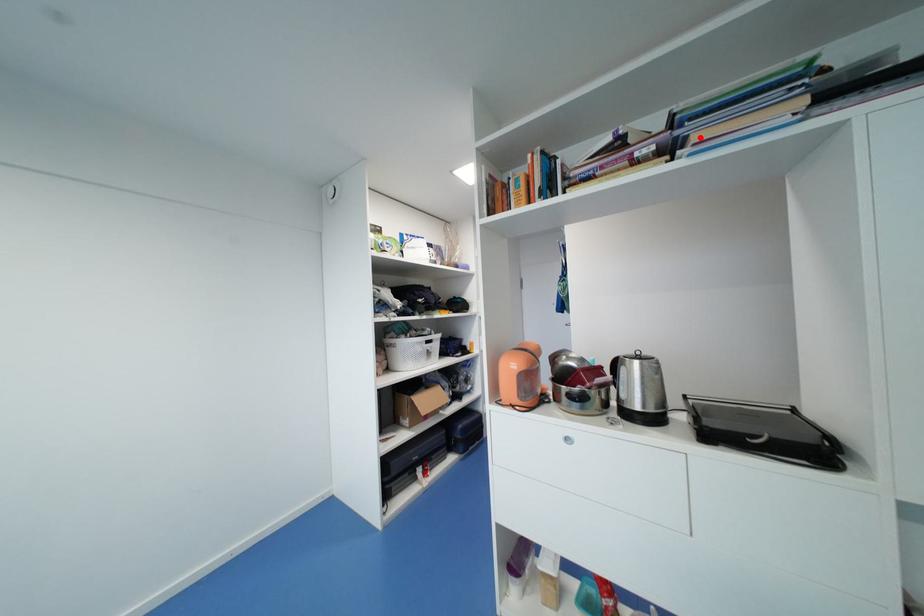
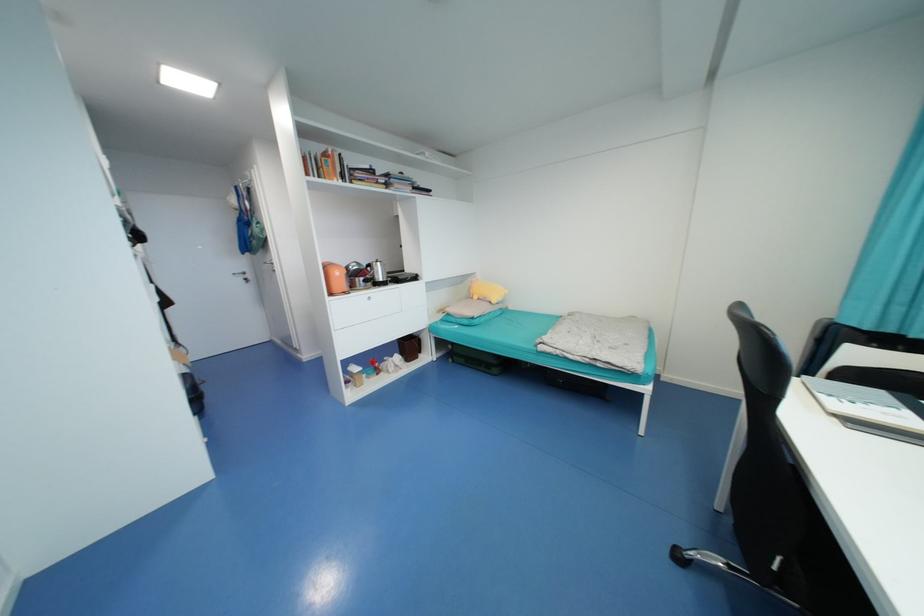
Find the pixel in the second image that matches the highlighted location in the first image.

(399, 187)